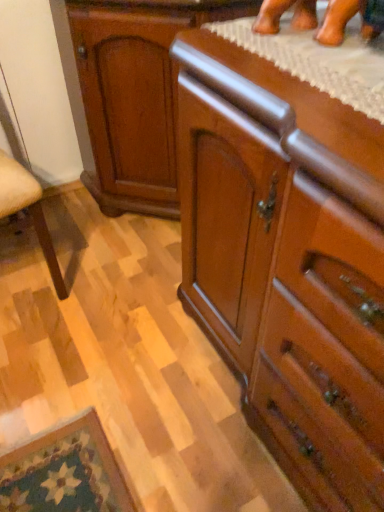
Question: Is polished wood chest of drawers at center bigger than glossy wood cabinet at center?

Choices:
 (A) yes
 (B) no

Answer: (A)

Question: From the image's perspective, does polished wood chest of drawers at center appear higher than glossy wood cabinet at center?

Choices:
 (A) no
 (B) yes

Answer: (A)

Question: Can you confirm if polished wood chest of drawers at center is shorter than glossy wood cabinet at center?

Choices:
 (A) no
 (B) yes

Answer: (A)

Question: Does polished wood chest of drawers at center have a greater width compared to glossy wood cabinet at center?

Choices:
 (A) yes
 (B) no

Answer: (A)

Question: Is polished wood chest of drawers at center surrounding glossy wood cabinet at center?

Choices:
 (A) yes
 (B) no

Answer: (B)

Question: Does polished wood chest of drawers at center turn towards glossy wood cabinet at center?

Choices:
 (A) yes
 (B) no

Answer: (B)

Question: Can you confirm if glossy wood cabinet at center is shorter than polished wood chest of drawers at center?

Choices:
 (A) yes
 (B) no

Answer: (A)

Question: From the image's perspective, is glossy wood cabinet at center above polished wood chest of drawers at center?

Choices:
 (A) yes
 (B) no

Answer: (A)

Question: Would you say glossy wood cabinet at center is a long distance from polished wood chest of drawers at center?

Choices:
 (A) yes
 (B) no

Answer: (B)

Question: Can you confirm if glossy wood cabinet at center is smaller than polished wood chest of drawers at center?

Choices:
 (A) no
 (B) yes

Answer: (B)

Question: Considering the relative sizes of glossy wood cabinet at center and polished wood chest of drawers at center in the image provided, is glossy wood cabinet at center taller than polished wood chest of drawers at center?

Choices:
 (A) yes
 (B) no

Answer: (B)

Question: Does glossy wood cabinet at center turn towards polished wood chest of drawers at center?

Choices:
 (A) yes
 (B) no

Answer: (B)

Question: In terms of size, does glossy wood cabinet at center appear bigger or smaller than polished wood chest of drawers at center?

Choices:
 (A) big
 (B) small

Answer: (B)